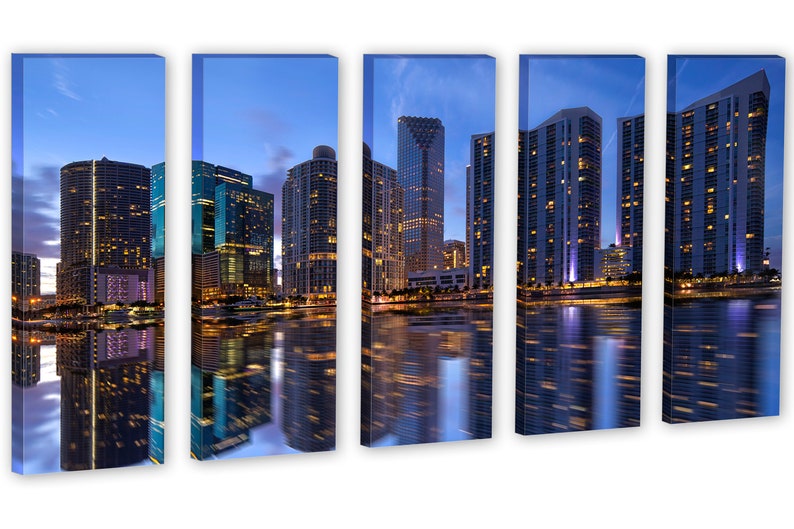
Locate an element on the screen. Image resolution: width=794 pixels, height=529 pixels. wall is located at coordinates (510, 467).